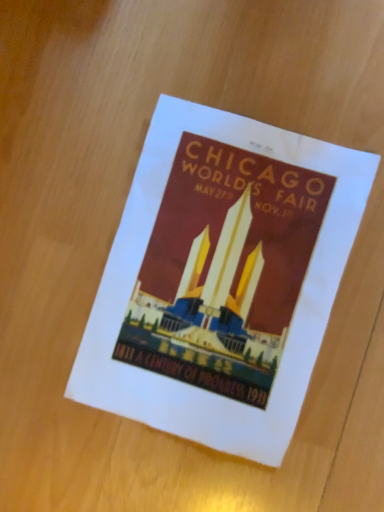
This screenshot has width=384, height=512. I want to click on free spot above matte paper poster at center (from a real-world perspective), so click(x=215, y=274).